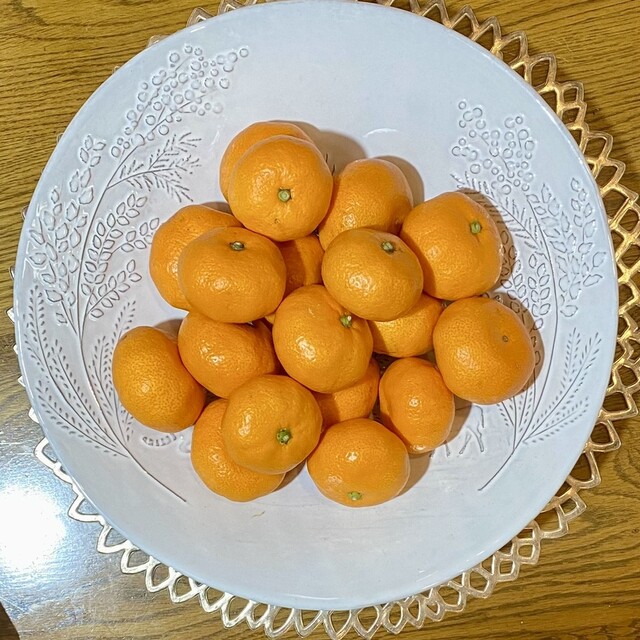
Find the location of a particular element. light reflected off the table is located at coordinates (26, 534).